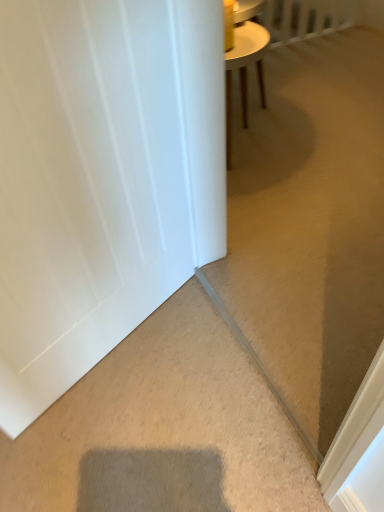
Describe the element at coordinates (101, 179) in the screenshot. I see `white matte door at left` at that location.

The image size is (384, 512). I want to click on white matte door at left, so click(x=101, y=179).

What are the coordinates of `white matte door at left` in the screenshot? It's located at (101, 179).